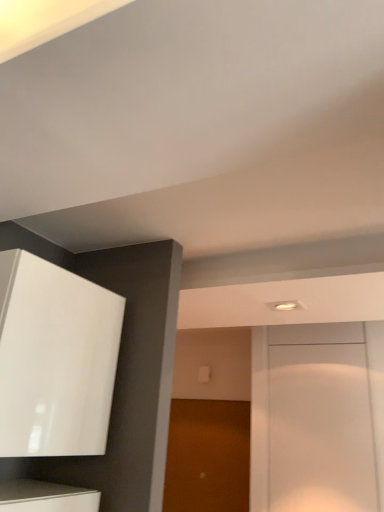
Question: Is brown matte door at center, the second door viewed from the front, situated inside white glossy door at center, placed as the first door when sorted from front to back, or outside?

Choices:
 (A) outside
 (B) inside

Answer: (A)

Question: Is brown matte door at center, which is counted as the 1th door, starting from the left, bigger or smaller than white glossy door at center, which ranks as the second door in back-to-front order?

Choices:
 (A) big
 (B) small

Answer: (A)

Question: Which is nearer to the white glossy door at center, which ranks as the first door in right-to-left order?

Choices:
 (A) brown matte door at center, the 1th door when ordered from back to front
 (B) glossy white cabinet at upper left

Answer: (A)

Question: Which object is the farthest from the white glossy door at center, placed as the first door when sorted from front to back?

Choices:
 (A) glossy white cabinet at upper left
 (B) brown matte door at center, which is counted as the 1th door, starting from the left

Answer: (A)